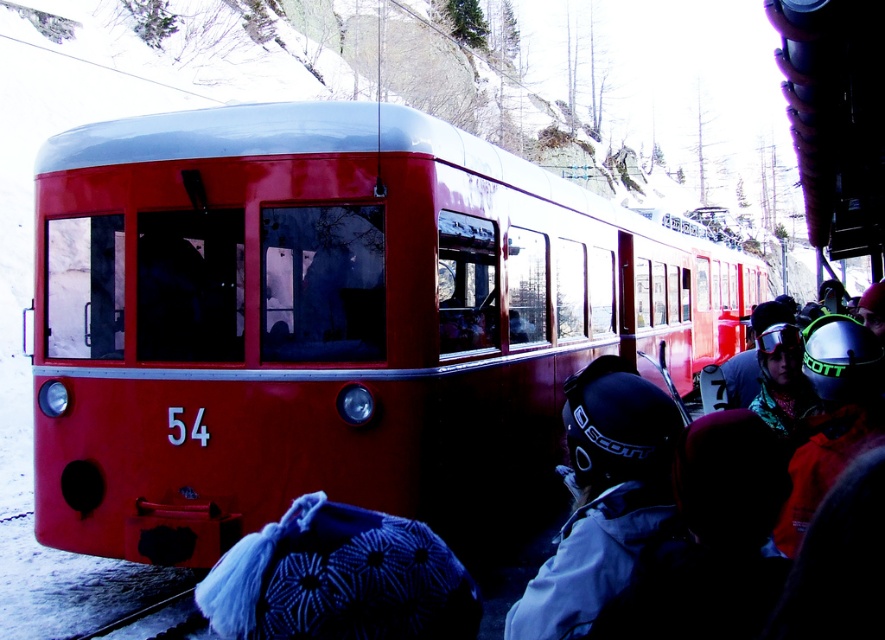
You are a photographer trying to capture both the shiny red train at center and the matte black helmet at center in the same frame. Since you want to ensure the train is clearly visible, which object should you focus on first, considering their heights?

The shiny red train at center is taller than the matte black helmet at center, so you should focus on the shiny red train at center first to ensure it is clearly visible in the frame.

You are standing at the ski station and want to take a photo of the train and the skiers. The train is at point (496, 168) and the skiers are at point (560, 620). Based on their positions, which one should you focus on first to ensure both are in the frame?

Point (496, 168) is behind point (560, 620), so you should focus on the skiers at point (560, 620) first to ensure both are in the frame.

You are standing at the point marked by the coordinates point (325, 317). Looking around, you see the shiny red train at center. Which direction should you face to see the shiny red train at center?

You are already at the point marked by the coordinates point (325, 317), which is where the shiny red train at center is located. Therefore, you are at the same location as the shiny red train at center and cannot see it from where you are standing.